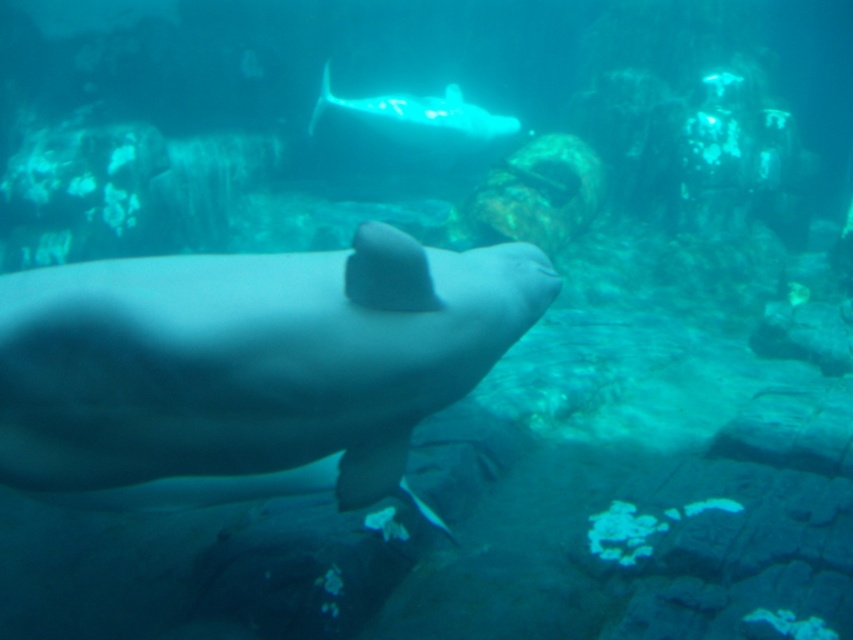
Who is more distant from viewer, (x=347, y=490) or (x=402, y=148)?

Point (x=402, y=148)

Which is behind, point (285, 481) or point (337, 145)?

Point (337, 145)

Where is `smooth gray whale at center`? This screenshot has height=640, width=853. smooth gray whale at center is located at coordinates (248, 365).